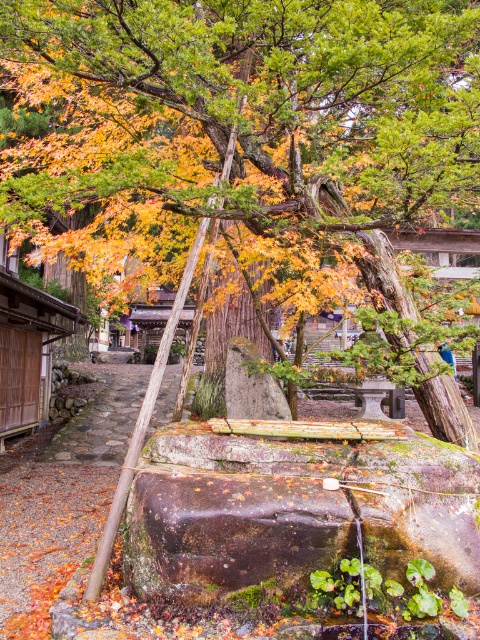
Is the position of autumn leaves at center less distant than that of brown stone path at center?

Yes, autumn leaves at center is closer to the viewer.

In the scene shown: Does autumn leaves at center appear on the right side of brown stone path at center?

Yes, autumn leaves at center is to the right of brown stone path at center.

Where is `autumn leaves at center`? The image size is (480, 640). autumn leaves at center is located at coordinates (249, 141).

At what (x,y) coordinates should I click in order to perform the action: click on autumn leaves at center. Please return your answer as a coordinate pair (x, y). The width and height of the screenshot is (480, 640). Looking at the image, I should click on (249, 141).